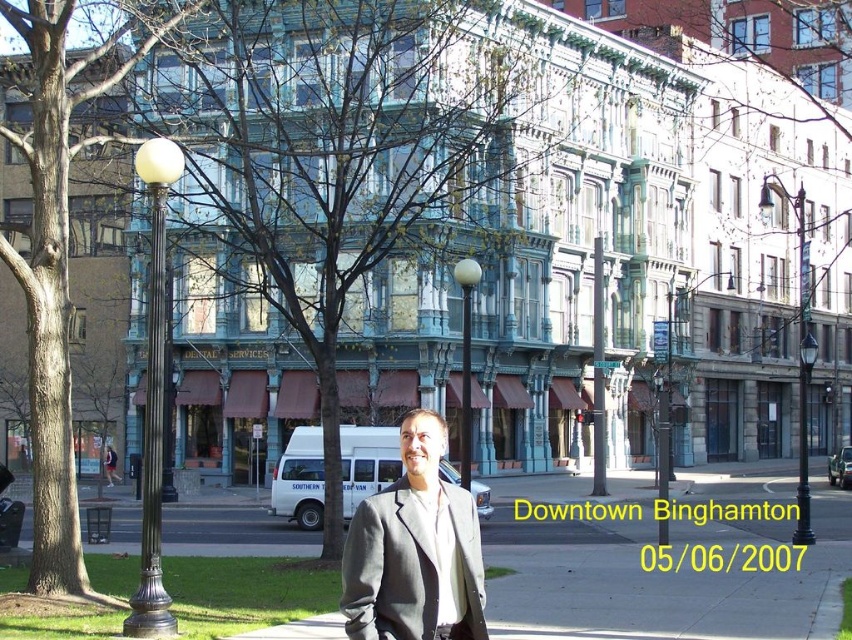
Question: Is brown wood tree at left positioned in front of gray wool suit at center?

Choices:
 (A) no
 (B) yes

Answer: (A)

Question: Which point is farther from the camera taking this photo?

Choices:
 (A) (353, 628)
 (B) (39, 131)
 (C) (239, 60)

Answer: (C)

Question: Which object is positioned closest to the gray wool suit at center?

Choices:
 (A) brown wood tree at left
 (B) green leafy tree at center

Answer: (A)

Question: Can you confirm if brown wood tree at left is thinner than gray wool suit at center?

Choices:
 (A) yes
 (B) no

Answer: (B)

Question: Can you confirm if green leafy tree at center is positioned to the right of brown wood tree at left?

Choices:
 (A) yes
 (B) no

Answer: (A)

Question: Among these objects, which one is nearest to the camera?

Choices:
 (A) green leafy tree at center
 (B) brown wood tree at left

Answer: (B)